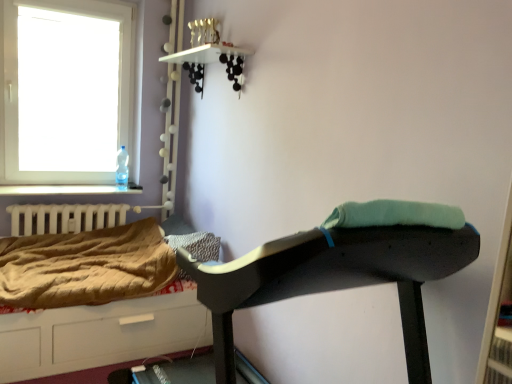
Question: Is brown quilted hospital bed at lower left wider than matte black ironing board at center?

Choices:
 (A) yes
 (B) no

Answer: (A)

Question: Is matte black ironing board at center inside brown quilted hospital bed at lower left?

Choices:
 (A) no
 (B) yes

Answer: (A)

Question: Is brown quilted hospital bed at lower left next to matte black ironing board at center and touching it?

Choices:
 (A) no
 (B) yes

Answer: (A)

Question: Is brown quilted hospital bed at lower left aimed at matte black ironing board at center?

Choices:
 (A) no
 (B) yes

Answer: (B)

Question: From a real-world perspective, is brown quilted hospital bed at lower left on top of matte black ironing board at center?

Choices:
 (A) yes
 (B) no

Answer: (B)

Question: From the image's perspective, is brown quilted blanket at lower left above or below transparent glass window at upper left?

Choices:
 (A) below
 (B) above

Answer: (A)

Question: Does point (102, 266) appear closer or farther from the camera than point (102, 13)?

Choices:
 (A) closer
 (B) farther

Answer: (A)

Question: Looking at their shapes, would you say brown quilted blanket at lower left is wider or thinner than transparent glass window at upper left?

Choices:
 (A) thin
 (B) wide

Answer: (B)

Question: From a real-world perspective, is brown quilted blanket at lower left above or below transparent glass window at upper left?

Choices:
 (A) above
 (B) below

Answer: (B)

Question: Is white matte radiator at left in front of or behind brown quilted hospital bed at lower left in the image?

Choices:
 (A) behind
 (B) front

Answer: (A)

Question: From the image's perspective, relative to brown quilted hospital bed at lower left, is white matte radiator at left above or below?

Choices:
 (A) below
 (B) above

Answer: (B)

Question: Considering the positions of point (37, 213) and point (59, 344), is point (37, 213) closer or farther from the camera than point (59, 344)?

Choices:
 (A) closer
 (B) farther

Answer: (B)

Question: Choose the correct answer: Is white matte radiator at left inside brown quilted hospital bed at lower left or outside it?

Choices:
 (A) outside
 (B) inside

Answer: (A)

Question: Does point (105, 173) appear closer or farther from the camera than point (118, 332)?

Choices:
 (A) farther
 (B) closer

Answer: (A)

Question: Is transparent glass window at upper left situated inside brown quilted hospital bed at lower left or outside?

Choices:
 (A) outside
 (B) inside

Answer: (A)